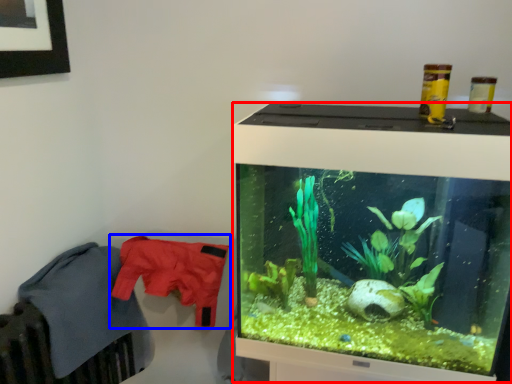
Question: Among these objects, which one is farthest to the camera, computer monitor (highlighted by a red box) or clothing (highlighted by a blue box)?

Choices:
 (A) computer monitor
 (B) clothing

Answer: (B)